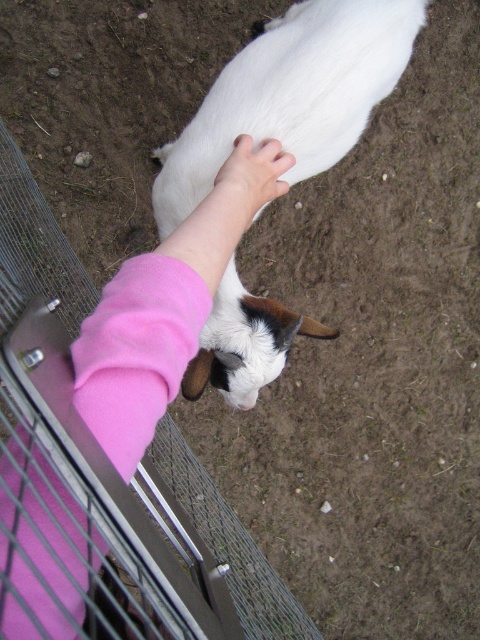
You are a farmer who wants to pet the white soft lamb at center but your hand, the pink soft hand at center, is currently 10.81 inches away. Can you reach the lamb without moving your hand closer?

The distance between the white soft lamb at center and the pink soft hand at center is 10.81 inches. Since the hand is not close enough to touch the lamb, you cannot reach the lamb without moving your hand closer.

You are a farmer checking the height of your animals. You see the pink fleece sleeve at center and the white soft lamb at center. Which one is shorter?

The pink fleece sleeve at center has a lesser height compared to the white soft lamb at center, so the pink fleece sleeve at center is shorter.